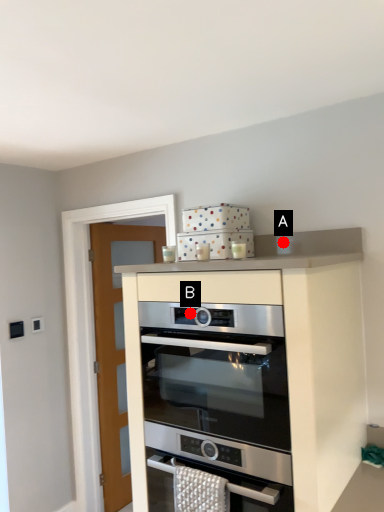
Question: Two points are circled on the image, labeled by A and B beside each circle. Among these points, which one is nearest to the camera?

Choices:
 (A) A is closer
 (B) B is closer

Answer: (B)